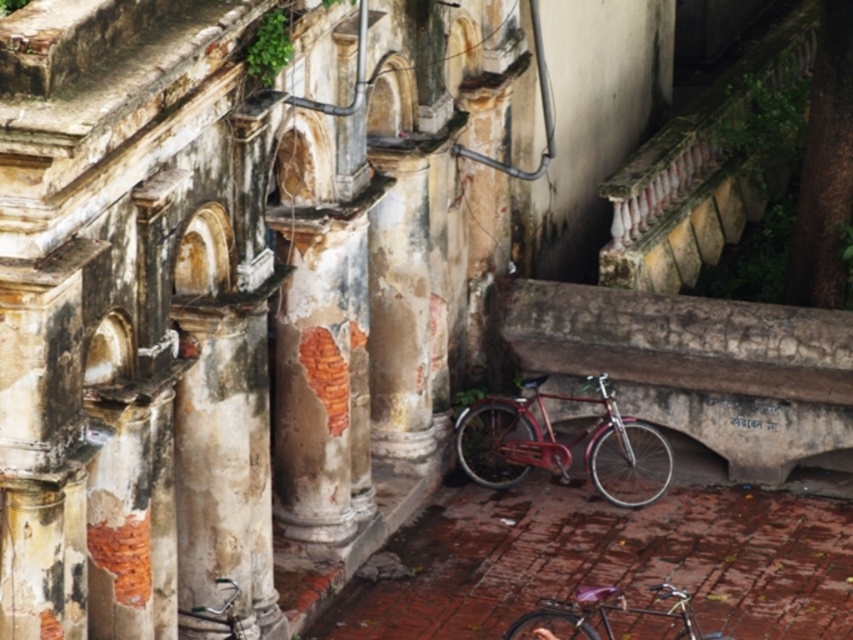
You are standing at the entrance of the historical building and see both the shiny metallic bicycle at lower center and the shiny purple bicycle at lower center. Which bicycle is positioned to the right side from your perspective?

A: The shiny metallic bicycle at lower center is positioned to the right of the shiny purple bicycle at lower center, so from your perspective, the shiny metallic bicycle at lower center is on the right side.

You are a delivery person needing to park your 1.2 meter wide delivery cart between the shiny metallic bicycle at lower center and the shiny purple bicycle at lower center. Can you fit your cart there?

The distance between the shiny metallic bicycle at lower center and the shiny purple bicycle at lower center is 3.74 meters. Since your cart is only 1.2 meters wide, there is enough space to park it between them.

You are standing at the entrance of the historical building and see the shiny metallic bicycle at lower center and the shiny purple bicycle at lower center. Which bicycle is taller?

The shiny metallic bicycle at lower center is taller than the shiny purple bicycle at lower center according to the description.